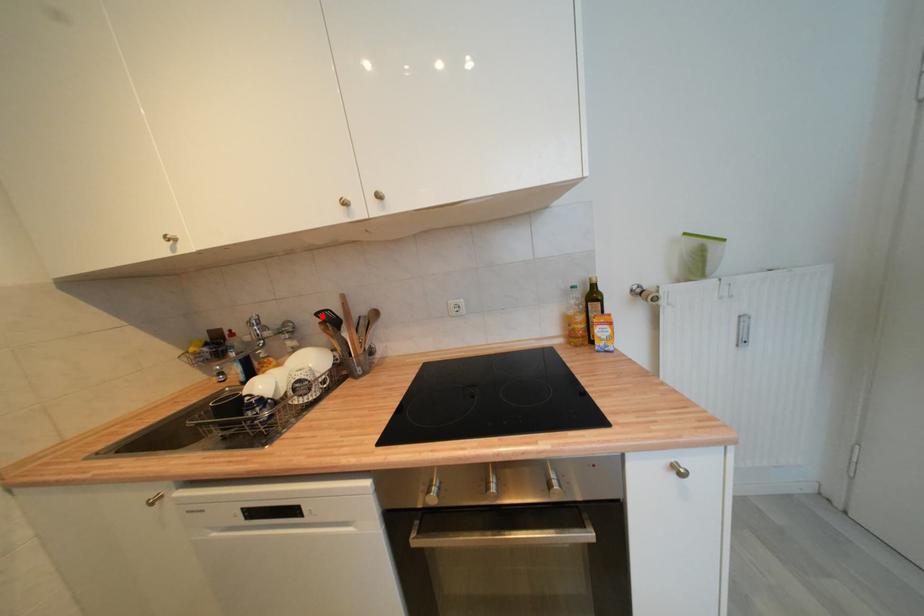
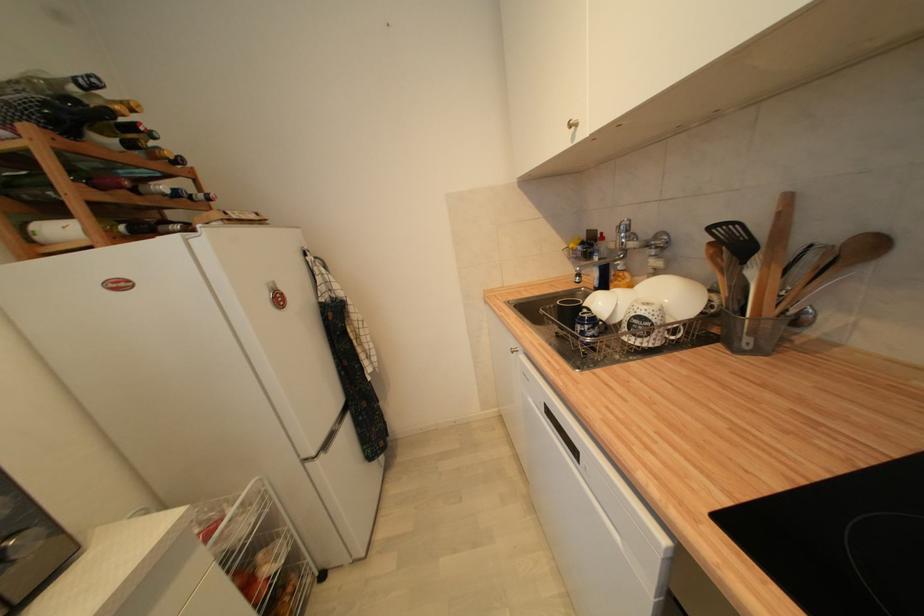
In the second image, find the point that corresponds to the highlighted location in the first image.

(715, 230)